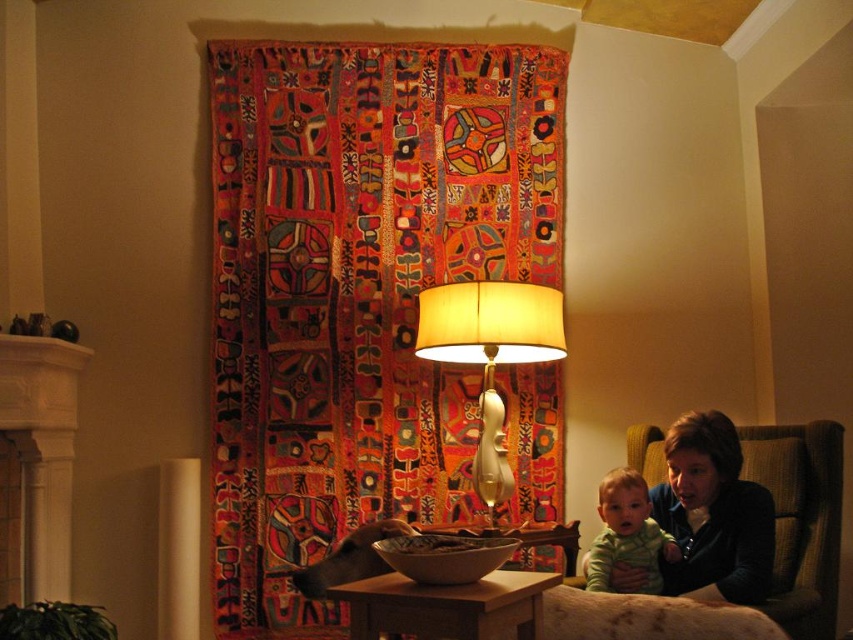
Question: Which of the following is the farthest from the observer?

Choices:
 (A) wooden table at center
 (B) multicolored woven tapestry at upper center
 (C) dark brown leather jacket at lower right

Answer: (B)

Question: Observing the image, what is the correct spatial positioning of white porcelain lamp at center in reference to wooden table at center?

Choices:
 (A) right
 (B) left

Answer: (A)

Question: Can you confirm if white porcelain lamp at center is bigger than wooden table at center?

Choices:
 (A) no
 (B) yes

Answer: (B)

Question: Which point is farther to the camera?

Choices:
 (A) green soft baby at lower right
 (B) wooden table at center
 (C) multicolored woven tapestry at upper center

Answer: (C)

Question: Which object is positioned farthest from the green soft baby at lower right?

Choices:
 (A) wooden table at center
 (B) smooth brown bowl at center
 (C) dark brown leather jacket at lower right

Answer: (A)

Question: Is multicolored woven tapestry at upper center below dark brown leather jacket at lower right?

Choices:
 (A) yes
 (B) no

Answer: (B)